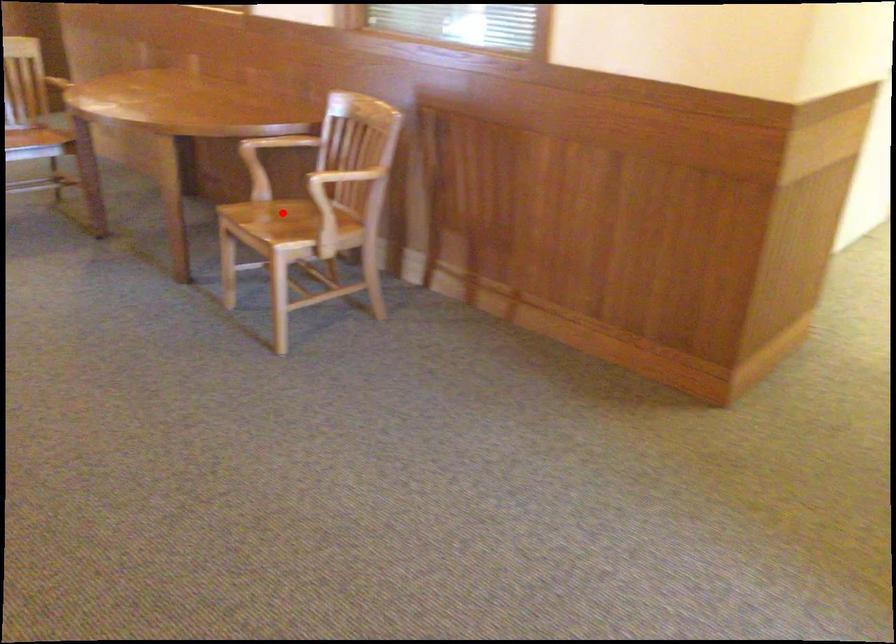
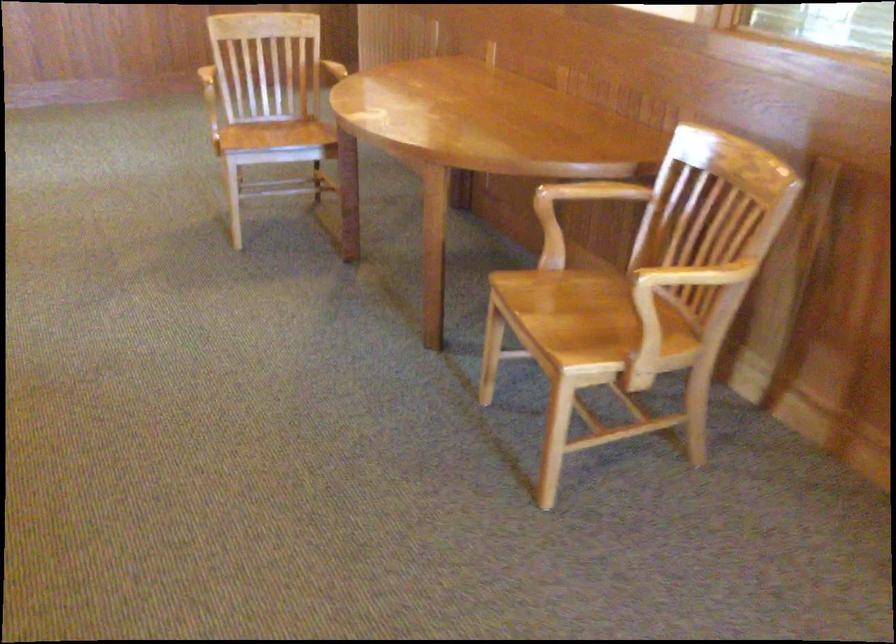
Question: I am providing you with two images of the same scene from different viewpoints. Given a red point in image1, look at the same physical point in image2. Is it:

Choices:
 (A) Closer to the viewpoint
 (B) Farther from the viewpoint

Answer: (A)